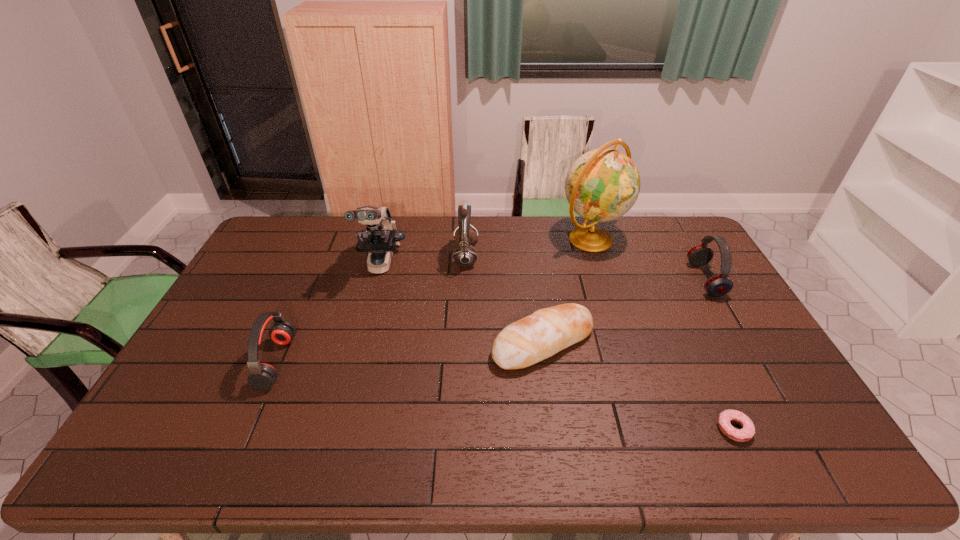
The image size is (960, 540). In the image, there is a desktop. In order to click on free space at the far right corner in this screenshot , I will do `click(682, 246)`.

Where is `free spot between the rightmost earphone and the microscope`? The height and width of the screenshot is (540, 960). free spot between the rightmost earphone and the microscope is located at coordinates (542, 272).

Where is `free space that is in between the bread and the rightmost earphone`? free space that is in between the bread and the rightmost earphone is located at coordinates (624, 311).

The image size is (960, 540). In order to click on free area in between the nearest earphone and the sixth object from right to left in this screenshot , I will do `click(328, 313)`.

You are a GUI agent. You are given a task and a screenshot of the screen. Output one action in this format:
    pyautogui.click(x=<x>, y=<y>)
    Task: Click on the vacant space that is in between the microscope and the globe
    
    Given the screenshot: What is the action you would take?
    pyautogui.click(x=486, y=251)

Find the location of a particular element. The image size is (960, 540). free space between the tallest object and the rightmost earphone is located at coordinates (648, 259).

Where is `blank region between the third object from left to right and the sixth object from right to left`? blank region between the third object from left to right and the sixth object from right to left is located at coordinates (423, 260).

What are the coordinates of `empty space between the rightmost object and the nearest earphone` in the screenshot? It's located at (491, 321).

Find the location of a particular element. vacant area between the sixth tallest object and the rightmost earphone is located at coordinates (624, 311).

This screenshot has height=540, width=960. Find the location of `vacant area that lies between the second earphone from left to right and the leftmost object`. vacant area that lies between the second earphone from left to right and the leftmost object is located at coordinates (372, 309).